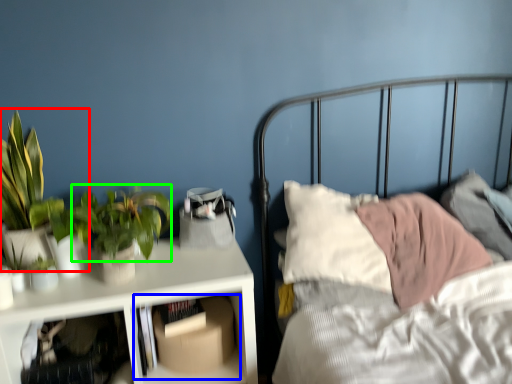
Question: Which object is positioned farthest from houseplant (highlighted by a red box)? Select from shelf (highlighted by a blue box) and vegetation (highlighted by a green box).

Choices:
 (A) shelf
 (B) vegetation

Answer: (A)